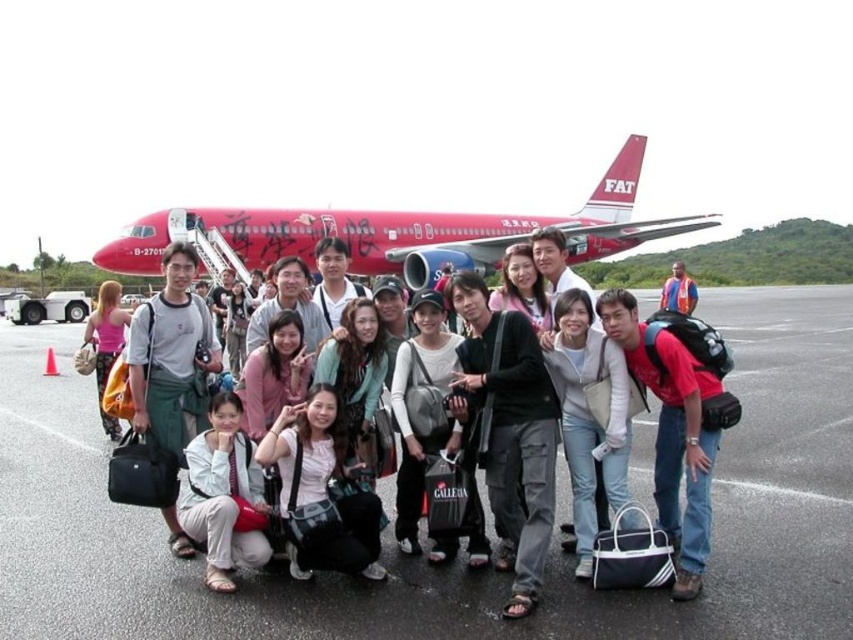
Question: Does matte pink top at center have a greater width compared to matte black jacket at center?

Choices:
 (A) yes
 (B) no

Answer: (A)

Question: Does white fabric bag at center have a greater width compared to white fabric pants at lower center?

Choices:
 (A) no
 (B) yes

Answer: (B)

Question: Which object appears closest to the camera in this image?

Choices:
 (A) matte black camera at center
 (B) matte pink top at center

Answer: (B)

Question: Which point is closer to the camera taking this photo?

Choices:
 (A) (289, 451)
 (B) (248, 538)

Answer: (B)

Question: Among these objects, which one is nearest to the camera?

Choices:
 (A) white matte jacket at center
 (B) matte black jacket at center
 (C) matte pink top at center
 (D) white matte bag at center

Answer: (A)

Question: Can you confirm if matte red airplane at center is positioned to the right of matte black camera at center?

Choices:
 (A) no
 (B) yes

Answer: (B)